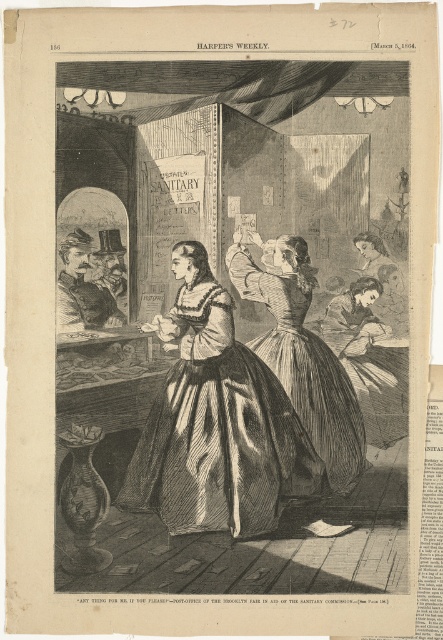
Does silvery satin dress at center have a larger size compared to silvery metallic dress at center?

Incorrect, silvery satin dress at center is not larger than silvery metallic dress at center.

Who is taller, silvery satin dress at center or silvery metallic dress at center?

silvery metallic dress at center is taller.

Is point (198, 300) positioned before point (335, 380)?

Yes.

Where is `silvery satin dress at center`? silvery satin dress at center is located at coordinates (217, 429).